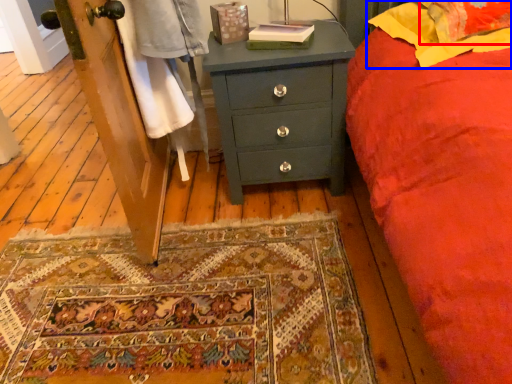
Question: Among these objects, which one is farthest to the camera, pillow (highlighted by a red box) or pillow (highlighted by a blue box)?

Choices:
 (A) pillow
 (B) pillow

Answer: (A)